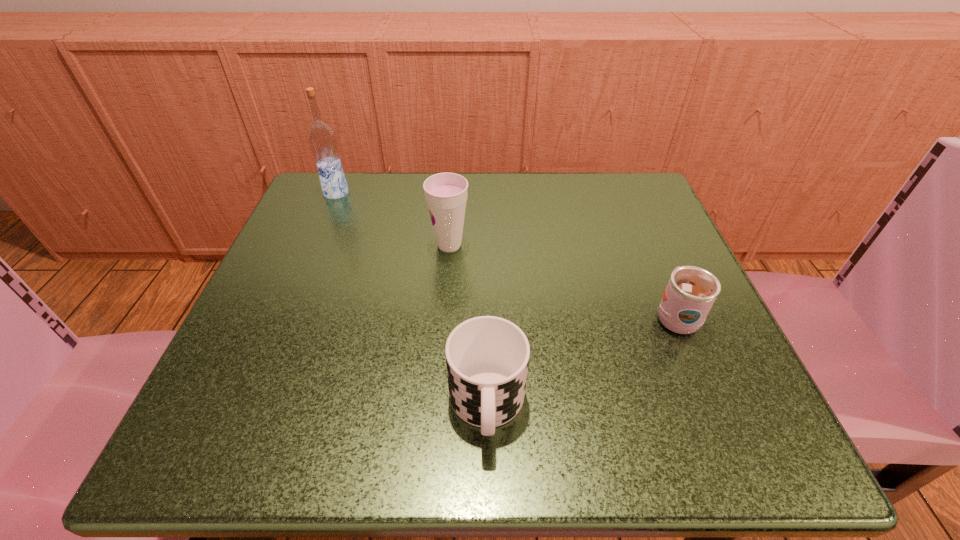
Locate an element on the screen. vacant area located on the side with the handle of the second nearest cup is located at coordinates (654, 265).

Locate an element on the screen. The width and height of the screenshot is (960, 540). free space located 0.090m on the side with the handle of the second nearest cup is located at coordinates (651, 257).

Image resolution: width=960 pixels, height=540 pixels. I want to click on vodka that is at the far edge, so click(x=322, y=138).

In order to click on cup located in the far edge section of the desktop in this screenshot , I will do `click(446, 194)`.

I want to click on object at the near edge, so click(x=487, y=357).

Where is `object present at the left edge`? The image size is (960, 540). object present at the left edge is located at coordinates (322, 138).

Where is `object that is at the right edge`? The image size is (960, 540). object that is at the right edge is located at coordinates (691, 291).

At what (x,y) coordinates should I click in order to perform the action: click on object positioned at the far left corner. Please return your answer as a coordinate pair (x, y). The image size is (960, 540). Looking at the image, I should click on (322, 138).

In the image, there is a desktop. Where is `free region at the far edge`? The width and height of the screenshot is (960, 540). free region at the far edge is located at coordinates (474, 173).

Identify the location of free space at the near edge. This screenshot has height=540, width=960. (338, 416).